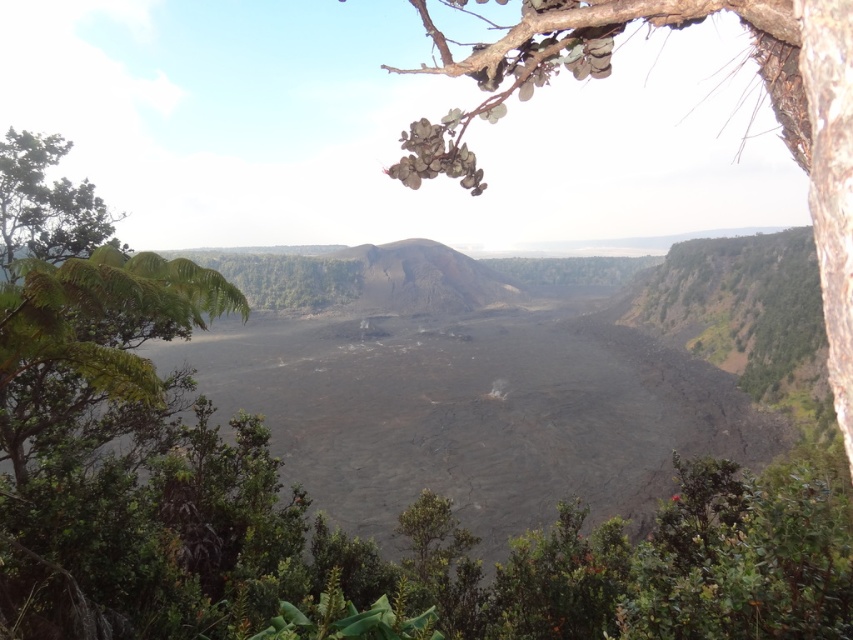
You are a botanist studying plant growth in volcanic areas. You notice two plants in the image, the green leafy branch at upper center and the green leafy tree at upper left. Which one is closer to your current position?

The green leafy branch at upper center is closer to your current position because it is only 21.48 meters away from the green leafy tree at upper left, implying that the branch is nearer to the observer.

You are an environmental scientist observing the volcanic landscape. You notice the green leafy branch at upper center and the green leafy tree at upper left. Which one is closer to you?

The green leafy branch at upper center is closer because it is in front of the green leafy tree at upper left.

You are standing at the point with coordinates point (15, 200) and want to reach the point with coordinates point (822, 252). Which direction should you move to get closer to your destination?

You should move forward because point (822, 252) is in front of point (15, 200).